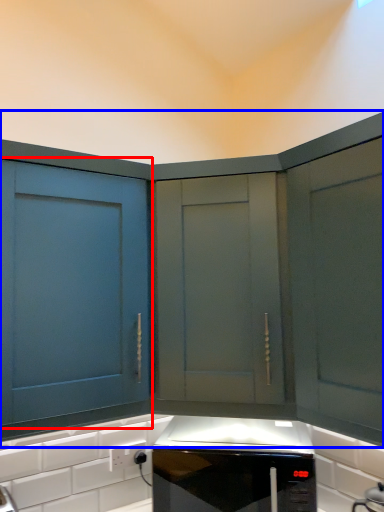
Question: Among these objects, which one is farthest to the camera, cabinetry (highlighted by a red box) or cabinetry (highlighted by a blue box)?

Choices:
 (A) cabinetry
 (B) cabinetry

Answer: (B)